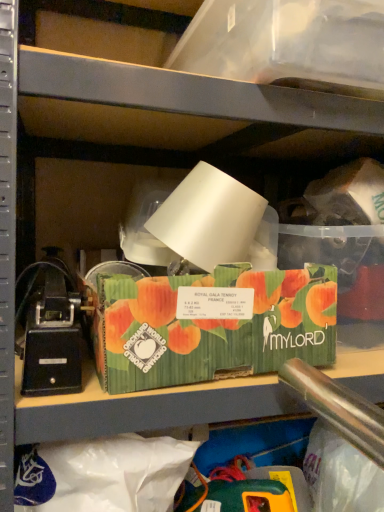
Question: From a real-world perspective, relative to green corrugated cardboard box at center, arranged as the 1th storage box when ordered from the bottom, is transparent plastic storage box at upper center, the 2th storage box in the bottom-to-top sequence, vertically above or below?

Choices:
 (A) below
 (B) above

Answer: (B)

Question: Is transparent plastic storage box at upper center, the 2th storage box in the bottom-to-top sequence, wider or thinner than green corrugated cardboard box at center, the second storage box from the top?

Choices:
 (A) wide
 (B) thin

Answer: (A)

Question: Which object is the closest to the black plastic toy at left?

Choices:
 (A) green corrugated cardboard box at center, the second storage box from the top
 (B) transparent plastic storage box at upper center, the 2th storage box in the bottom-to-top sequence

Answer: (A)

Question: Which of these objects is positioned farthest from the green corrugated cardboard box at center, the second storage box from the top?

Choices:
 (A) black plastic toy at left
 (B) transparent plastic storage box at upper center, the 1th storage box in the top-to-bottom sequence

Answer: (B)